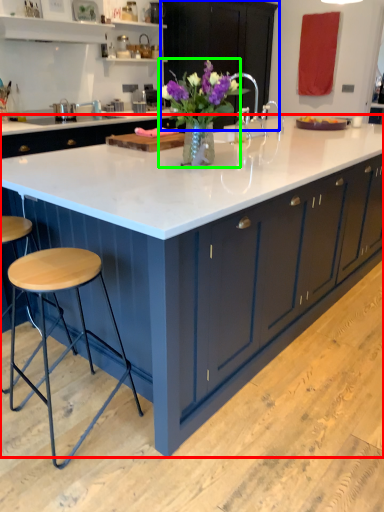
Question: Based on their relative distances, which object is nearer to countertop (highlighted by a red box)? Choose from cabinetry (highlighted by a blue box) and floral arrangement (highlighted by a green box).

Choices:
 (A) cabinetry
 (B) floral arrangement

Answer: (B)